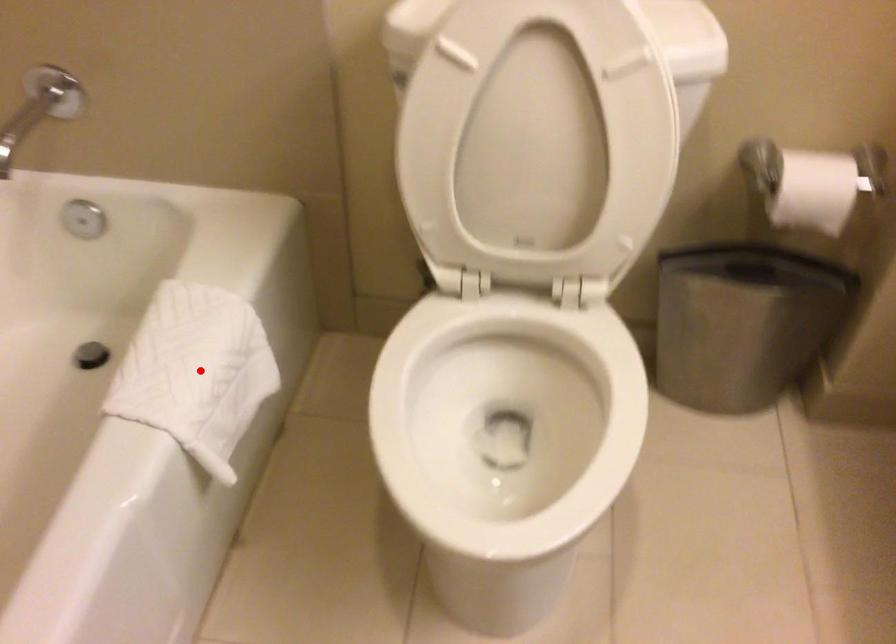
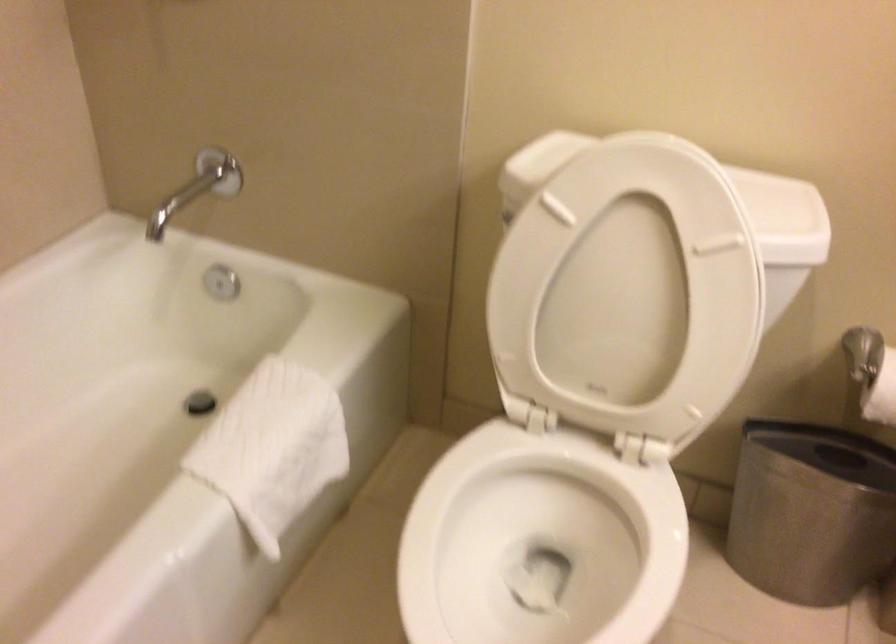
Find the pixel in the second image that matches the highlighted location in the first image.

(272, 448)